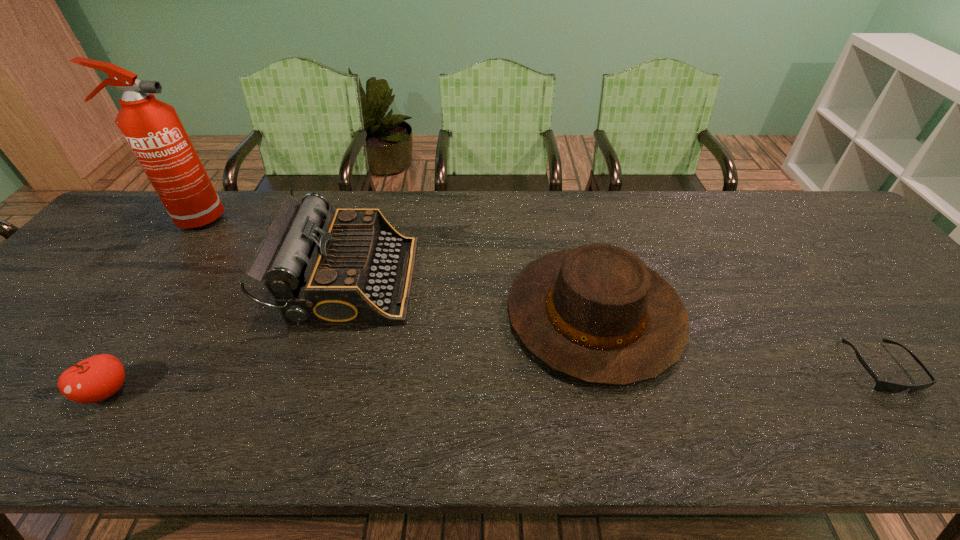
Where is `free point that satisfies the following two spatial constraints: 1. at the nozzle of the apple; 2. on the right side of the tallest object`? Image resolution: width=960 pixels, height=540 pixels. free point that satisfies the following two spatial constraints: 1. at the nozzle of the apple; 2. on the right side of the tallest object is located at coordinates (61, 391).